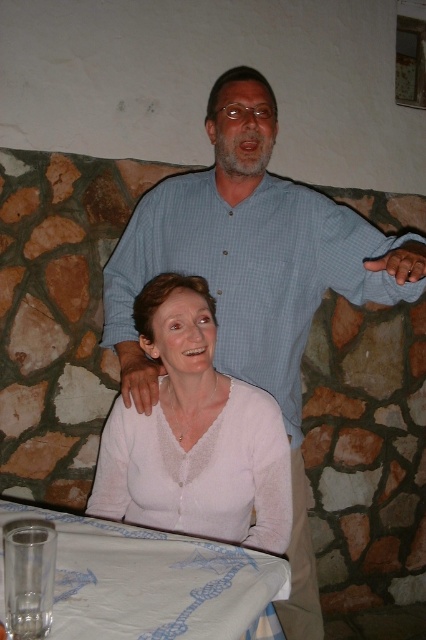
Does light blue checkered shirt at upper center have a smaller size compared to white sheer blouse at center?

No.

Consider the image. Is light blue checkered shirt at upper center positioned behind white sheer blouse at center?

That is False.

Where is `light blue checkered shirt at upper center`? light blue checkered shirt at upper center is located at coordinates (255, 280).

The image size is (426, 640). In order to click on light blue checkered shirt at upper center in this screenshot , I will do `click(255, 280)`.

Between light blue checkered shirt at upper center and transparent glass at lower left, which one appears on the left side from the viewer's perspective?

transparent glass at lower left

This screenshot has width=426, height=640. What do you see at coordinates (255, 280) in the screenshot? I see `light blue checkered shirt at upper center` at bounding box center [255, 280].

Does point (235, 225) come closer to viewer compared to point (63, 630)?

That is False.

Locate an element on the screen. Image resolution: width=426 pixels, height=640 pixels. light blue checkered shirt at upper center is located at coordinates (255, 280).

Which is behind, point (149, 284) or point (117, 544)?

The point (149, 284) is behind.

Who is positioned more to the right, white sheer blouse at center or transparent glass at lower left?

From the viewer's perspective, white sheer blouse at center appears more on the right side.

Which is in front, point (290, 512) or point (196, 625)?

Point (196, 625)

Where is `white sheer blouse at center`? This screenshot has height=640, width=426. white sheer blouse at center is located at coordinates (195, 435).